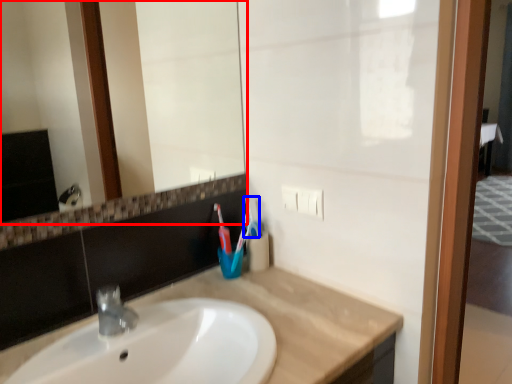
Question: Which object appears farthest to the camera in this image, mirror (highlighted by a red box) or toothbrush (highlighted by a blue box)?

Choices:
 (A) mirror
 (B) toothbrush

Answer: (B)